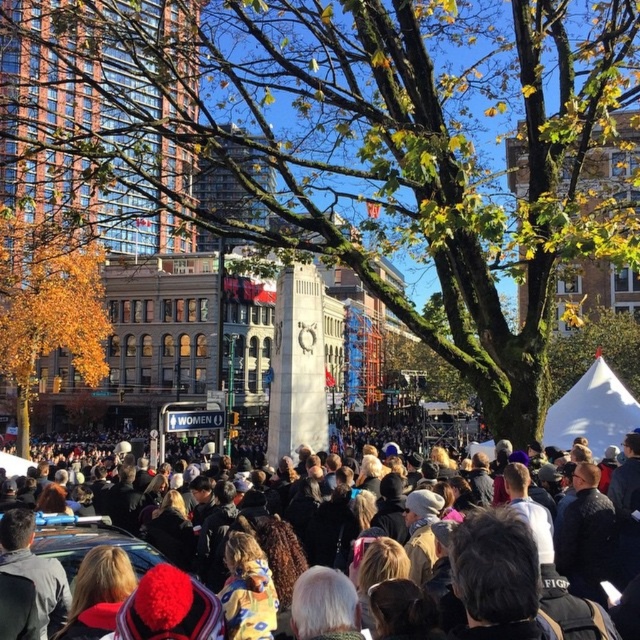
Is green mossy tree at center thinner than dark brown fur coat at center?

Incorrect, green mossy tree at center's width is not less than dark brown fur coat at center's.

Does green mossy tree at center appear over dark brown fur coat at center?

Indeed, green mossy tree at center is positioned over dark brown fur coat at center.

Describe the element at coordinates (348, 141) in the screenshot. I see `green mossy tree at center` at that location.

This screenshot has width=640, height=640. I want to click on green mossy tree at center, so click(x=348, y=141).

Is point (412, 113) behind point (106, 312)?

No, it is in front of (106, 312).

Who is positioned more to the right, green mossy tree at center or golden leaves at left?

green mossy tree at center

Find the location of a particular element. The image size is (640, 640). green mossy tree at center is located at coordinates (348, 141).

Does golden leaves at left have a greater height compared to dark brown fur coat at center?

Yes.

You are a GUI agent. You are given a task and a screenshot of the screen. Output one action in this format:
    pyautogui.click(x=<x>, y=<y>)
    Task: Click on the golden leaves at left
    
    Given the screenshot: What is the action you would take?
    pyautogui.click(x=48, y=307)